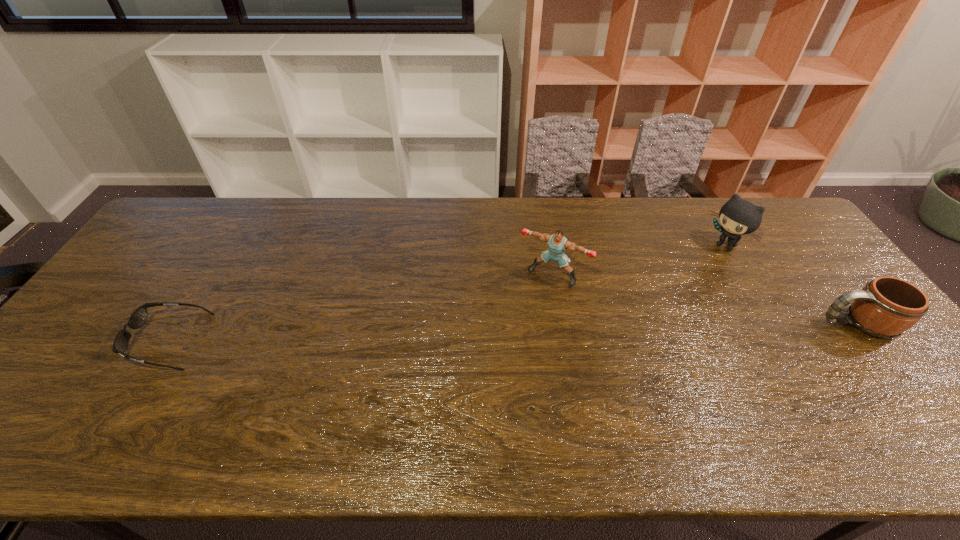
Locate an element on the screen. The height and width of the screenshot is (540, 960). sunglasses is located at coordinates tap(138, 318).

Where is `the leftmost object`? This screenshot has height=540, width=960. the leftmost object is located at coordinates (138, 318).

Identify the location of the third tallest object. The height and width of the screenshot is (540, 960). (886, 307).

In order to click on mug in this screenshot , I will do point(886,307).

Identify the location of the farthest object. This screenshot has height=540, width=960. (737, 217).

In order to click on the second object from right to left in this screenshot , I will do `click(737, 217)`.

Locate an element on the screen. the second farthest object is located at coordinates (557, 243).

I want to click on puncher, so click(557, 243).

You are a GUI agent. You are given a task and a screenshot of the screen. Output one action in this format:
    pyautogui.click(x=<x>, y=<y>)
    Task: Click on the vacant space situated 0.060m on the front-facing side of the shortest object
    The height and width of the screenshot is (540, 960).
    Given the screenshot: What is the action you would take?
    pyautogui.click(x=114, y=341)

Identify the location of free space located on the front-facing side of the shortest object. (103, 341).